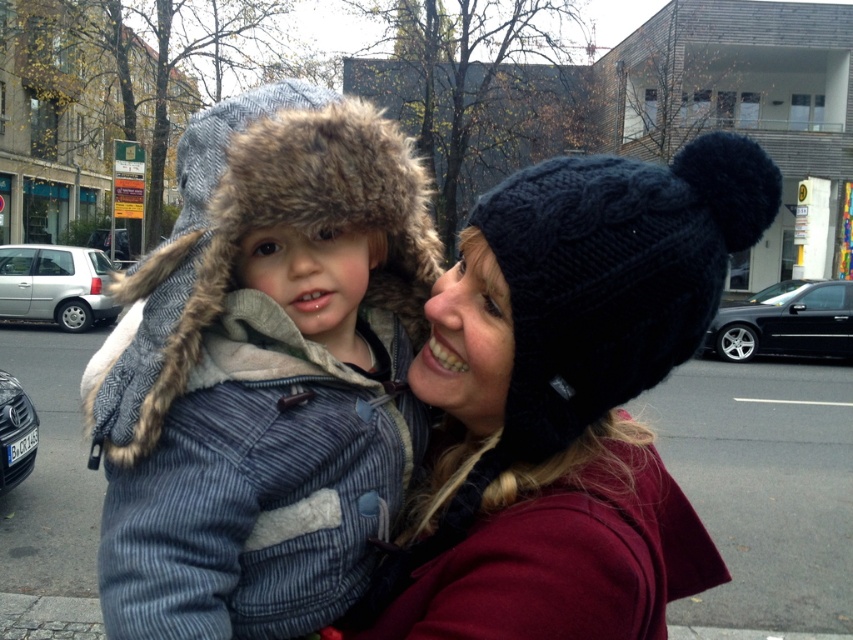
Is fuzzy fur hat at center smaller than knitted dark blue beanie at center?

Incorrect, fuzzy fur hat at center is not smaller in size than knitted dark blue beanie at center.

This screenshot has width=853, height=640. What do you see at coordinates (265, 385) in the screenshot?
I see `fuzzy fur hat at center` at bounding box center [265, 385].

This screenshot has height=640, width=853. I want to click on fuzzy fur hat at center, so click(x=265, y=385).